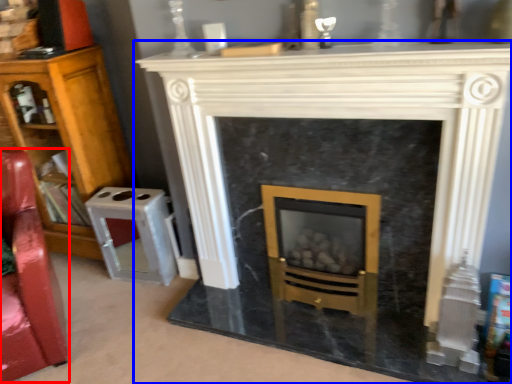
Question: Which of the following is the closest to the observer, swivel chair (highlighted by a red box) or fireplace (highlighted by a blue box)?

Choices:
 (A) swivel chair
 (B) fireplace

Answer: (B)